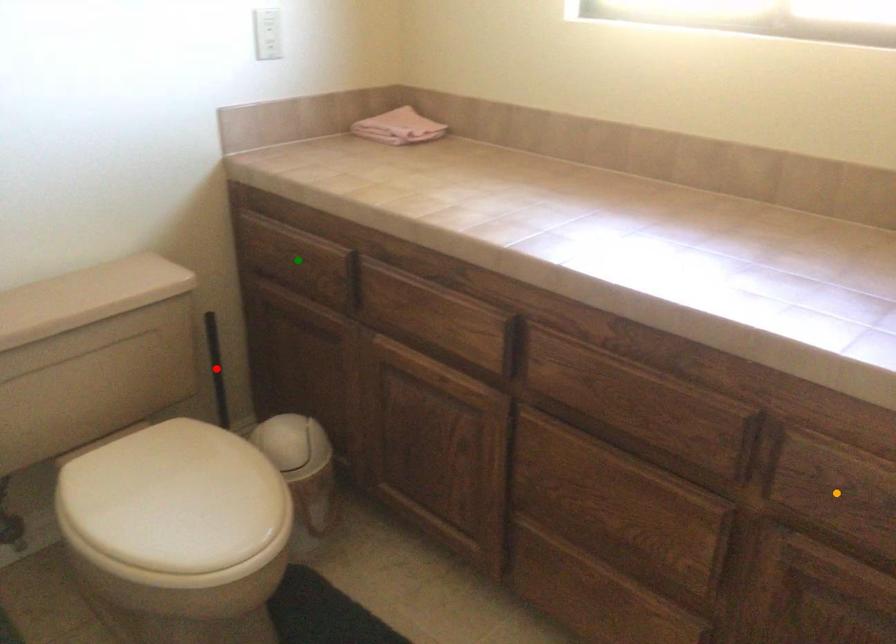
Order these from nearest to farthest:
red point | green point | orange point

red point → green point → orange point